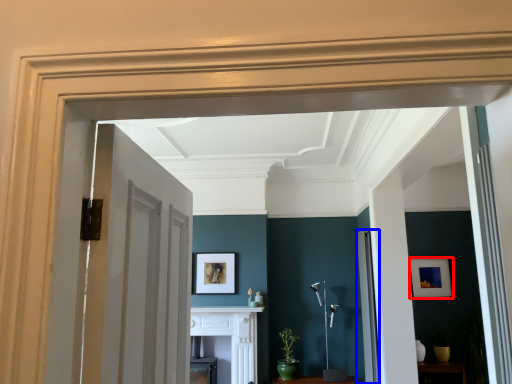
Question: Among these objects, which one is nearest to the camera, picture frame (highlighted by a red box) or door (highlighted by a blue box)?

Choices:
 (A) picture frame
 (B) door

Answer: (B)